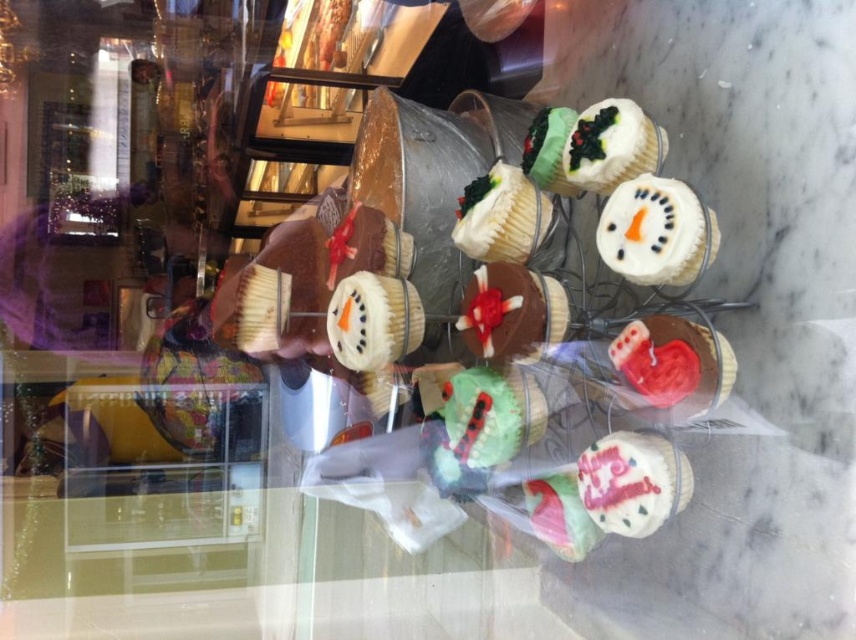
You are a customer in the bakery and want to buy the chocolate frosted cupcake with red icing at center. The store has a rule that any cupcake more than 30 inches away from the viewer cannot be sold due to being too far back. Can you purchase this cupcake?

The chocolate frosted cupcake with red icing at center is 31.89 inches from viewer, which exceeds the 30 inch limit. Therefore, you cannot purchase this cupcake.

Based on the photo, you are a customer at the bakery and want to buy the largest cupcake available. Looking at the display, which cupcake should you choose between the chocolate frosted cupcake with red icing at center and the pastel pink frosting at center?

The chocolate frosted cupcake with red icing at center is bigger than the pastel pink frosting at center, so you should choose the chocolate frosted cupcake with red icing at center.

You are a customer at the bakery and want to pick up two cupcakes. The cupcakes are located at point coordinates point [369,307] and point [613,154]. If you are standing in front of the rack, which cupcake should you reach for first to grab the one closer to you?

The cupcake at point [613,154] is closer to you, so you should reach for it first.